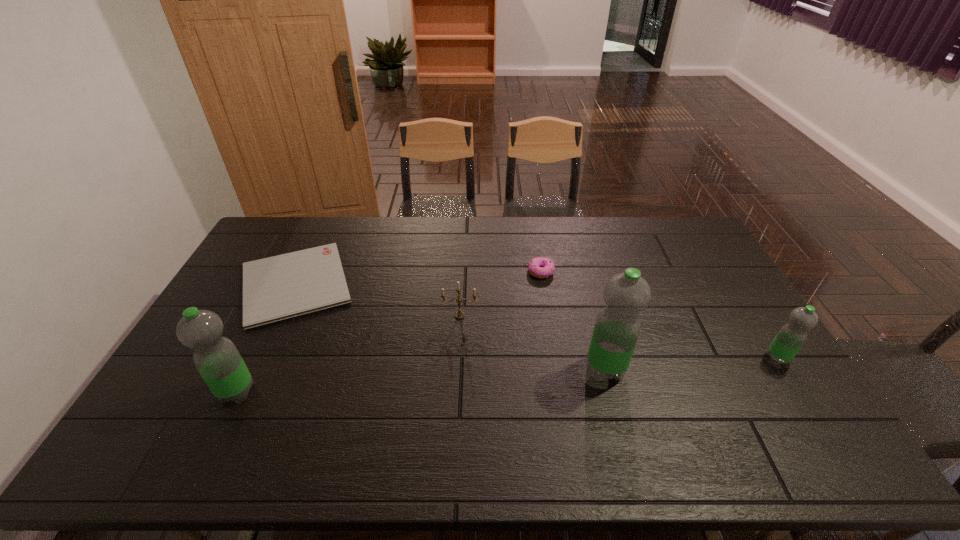
Identify the location of vacant area that lies between the fifth object from left to right and the doughnut. The image size is (960, 540). (573, 320).

Where is `unoccupied area between the second shortest object and the rightmost object`? unoccupied area between the second shortest object and the rightmost object is located at coordinates (660, 315).

Find the location of a particular element. The height and width of the screenshot is (540, 960). free space between the candle and the shortest object is located at coordinates (377, 300).

Image resolution: width=960 pixels, height=540 pixels. In order to click on free space between the rightmost object and the shortest object in this screenshot , I will do `click(537, 321)`.

Locate an element on the screen. The width and height of the screenshot is (960, 540). vacant area that lies between the rightmost water bottle and the second water bottle from right to left is located at coordinates (691, 363).

This screenshot has height=540, width=960. I want to click on empty space that is in between the fourth tallest object and the second water bottle from left to right, so click(x=533, y=342).

Locate an element on the screen. The image size is (960, 540). blank region between the doughnut and the clipboard is located at coordinates (419, 278).

Find the location of `unoccupied position between the doughnut and the leftmost water bottle`. unoccupied position between the doughnut and the leftmost water bottle is located at coordinates (389, 332).

Locate which object is the closest to the shortest water bottle. Please provide its 2D coordinates. Your answer should be formatted as a tuple, i.e. [(x, y)], where the tuple contains the x and y coordinates of a point satisfying the conditions above.

[(617, 328)]

Identify which object is the third nearest to the fifth shortest object. Please provide its 2D coordinates. Your answer should be formatted as a tuple, i.e. [(x, y)], where the tuple contains the x and y coordinates of a point satisfying the conditions above.

[(540, 267)]